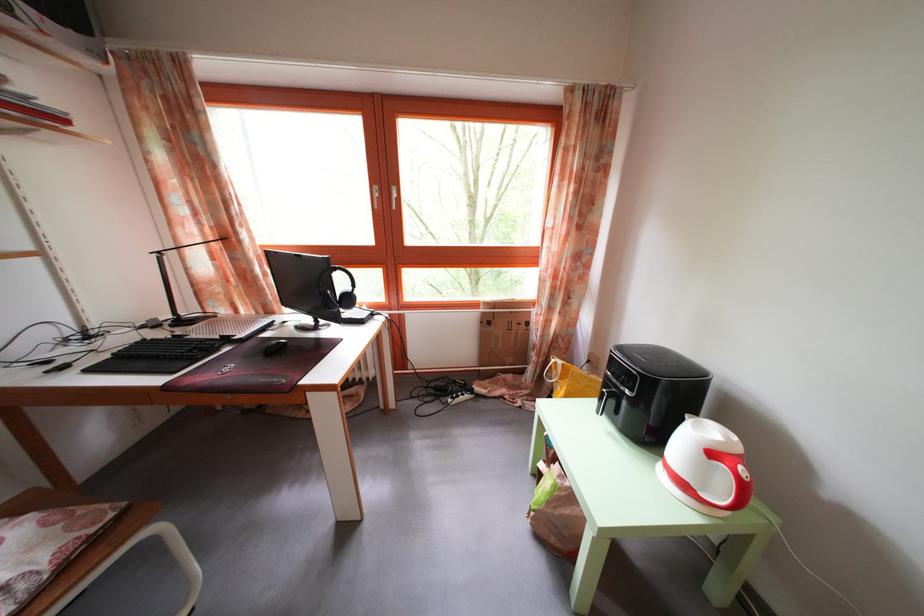
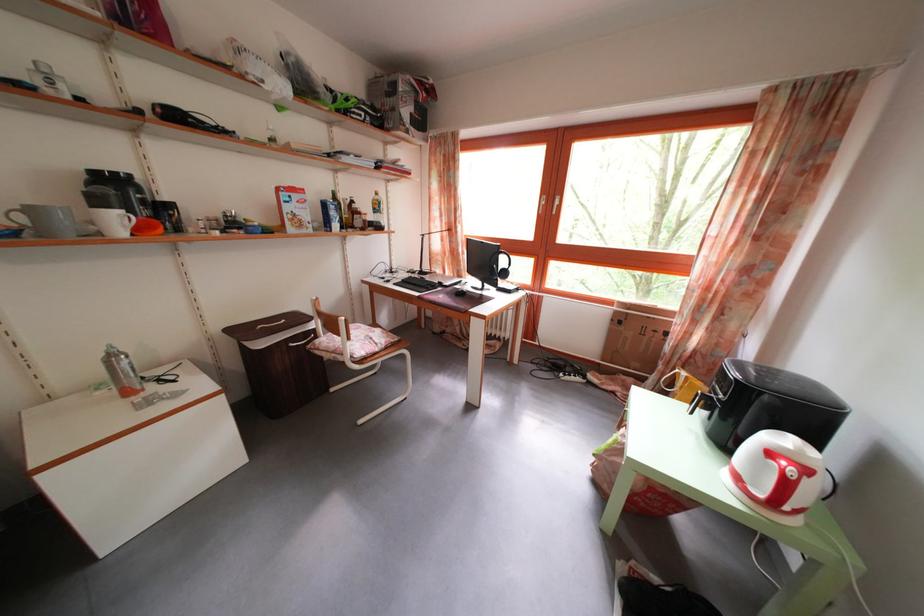
Find the pixel in the second image that matches (617,407) in the first image.

(713, 411)